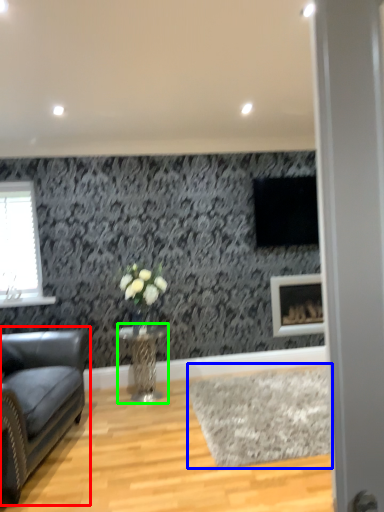
Question: Based on their relative distances, which object is farther from studio couch (highlighted by a red box)? Choose from plain (highlighted by a blue box) and table (highlighted by a green box).

Choices:
 (A) plain
 (B) table

Answer: (A)